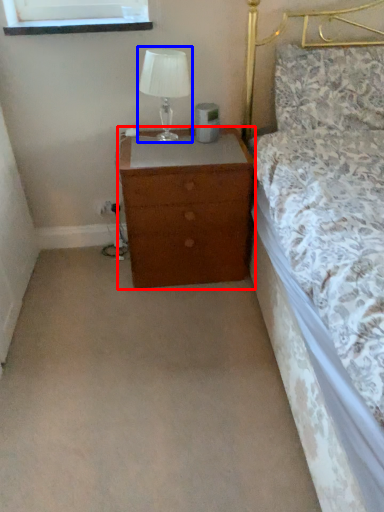
Question: Which of the following is the farthest to the observer, chest of drawers (highlighted by a red box) or table lamp (highlighted by a blue box)?

Choices:
 (A) chest of drawers
 (B) table lamp

Answer: (A)